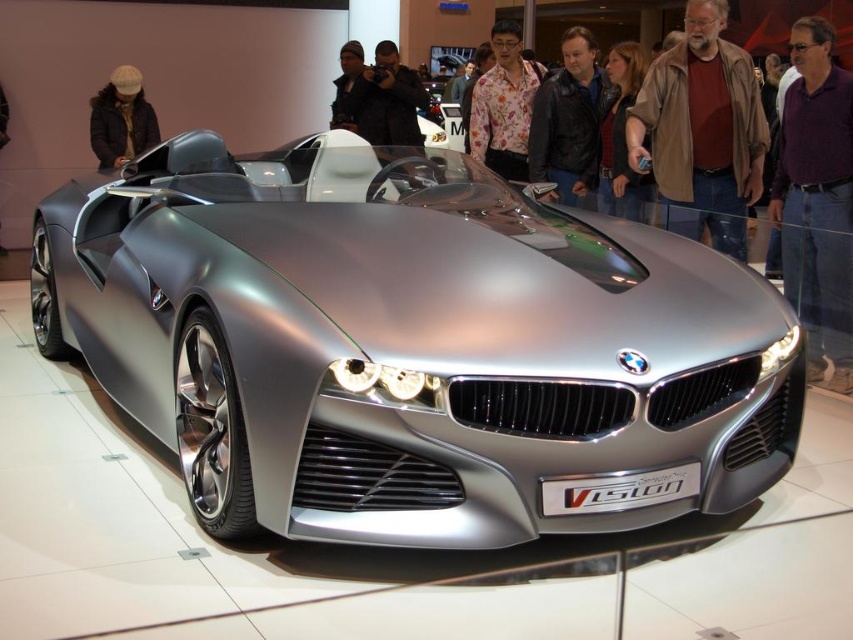
Consider the image. You are a fashion designer attending an auto show and see the BMW Vision model. You notice a floral shirt at center and a knit cap at upper left. Which clothing item would require more fabric to produce?

The floral shirt at center is bigger than the knit cap at upper left, so it would require more fabric to produce.

You are at an auto show and see the BMW Vision model. Where is the leather jacket at center located in relation to the car?

The leather jacket at center is located at point (567, 120) relative to the car.

Looking at this image, you are standing at the entrance of the auto show and want to take a photo of the satin silver car at center. The auto show has a grid system with coordinates from 0 to 1 on both axes. Where should you position yourself to capture the car in the frame?

To capture the satin silver car at center in your photo, you should position yourself at coordinates near the car, such as around point [413,346], to ensure it is centered in your frame.